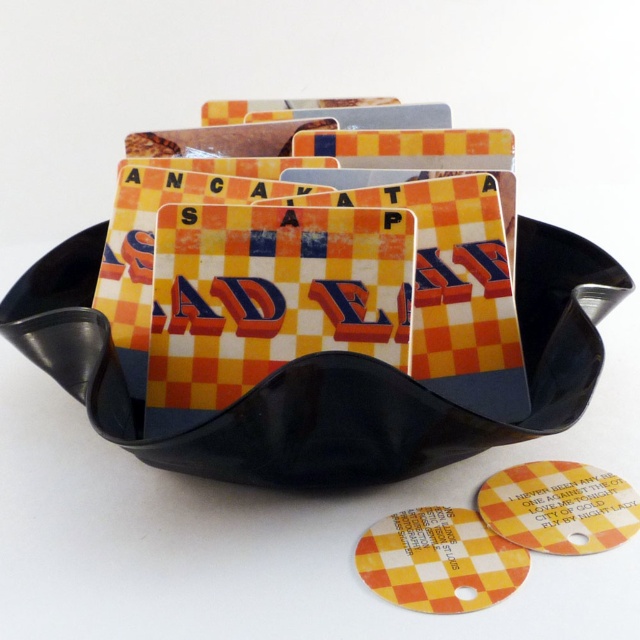
You are a barista organizing coasters for a retro themed cafe. You have a yellow checkered card at center and a yellow checkered coaster at center. Can you place a 10 inch wide promotional poster between them without overlapping?

The distance between the yellow checkered card at center and the yellow checkered coaster at center is 8.93 inches. Since the poster is 10 inches wide, it cannot fit between them without overlapping.

You are arranging coasters and chips on a table. You have a yellow checkered card at center and a yellow checkered chip at center. Which one is positioned more to the left?

The yellow checkered card at center is positioned more to the left than the yellow checkered chip at center.

You are organizing a party and want to place a yellow checkered chip at center on top of the yellow checkered coaster at center. Will the chip fit on the coaster without overhanging?

The yellow checkered chip at center is bigger than yellow checkered coaster at center, so it will overhang the edges of the coaster when placed on top.